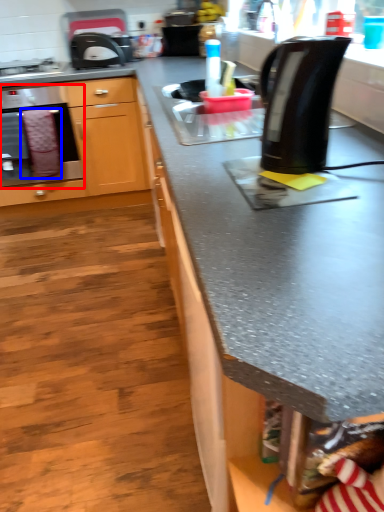
Question: Which object is further to the camera taking this photo, oven (highlighted by a red box) or blanket (highlighted by a blue box)?

Choices:
 (A) oven
 (B) blanket

Answer: (B)